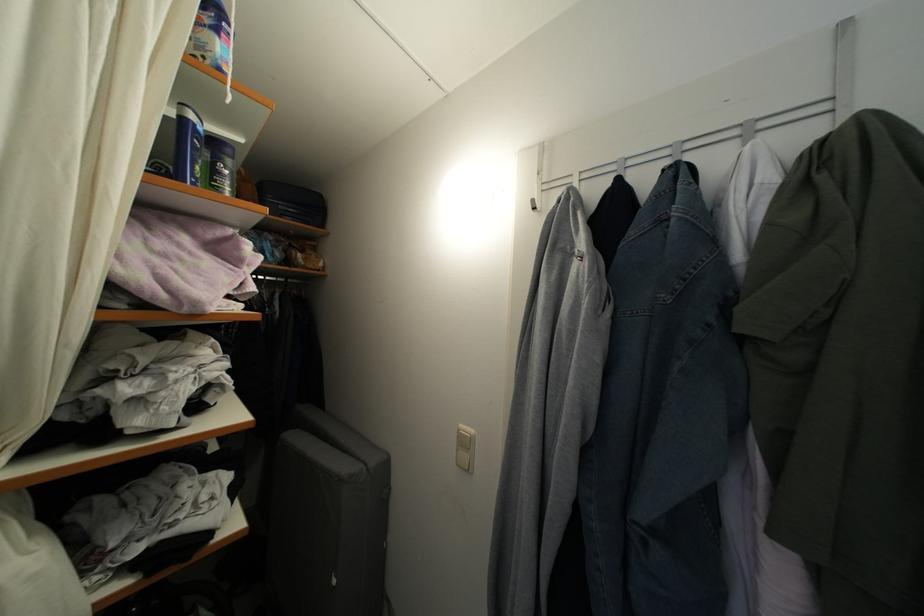
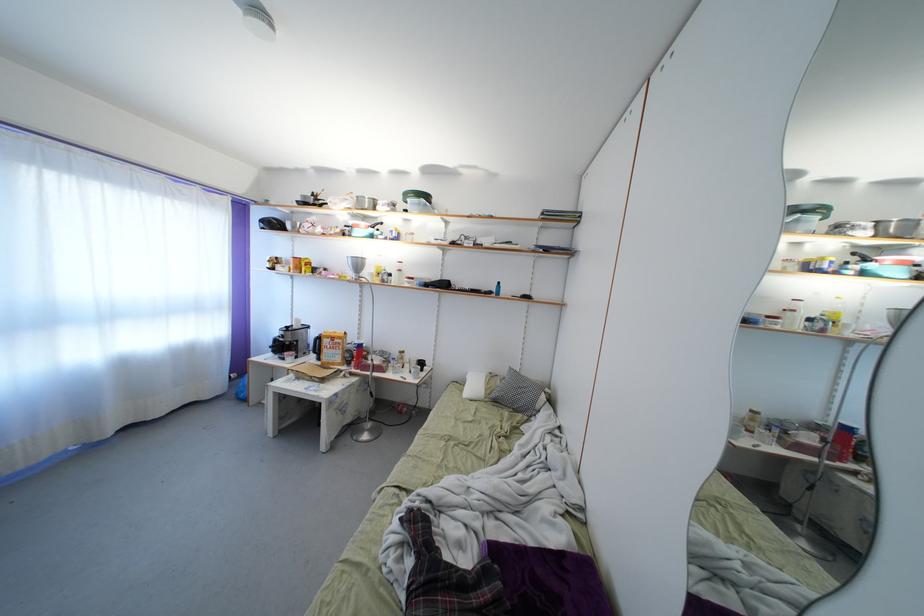
Question: The camera is either moving clockwise (left) or counter-clockwise (right) around the object. The first image is from the beginning of the video and the second image is from the end. Is the camera moving left or right when shooting the video?

Choices:
 (A) Left
 (B) Right

Answer: (B)